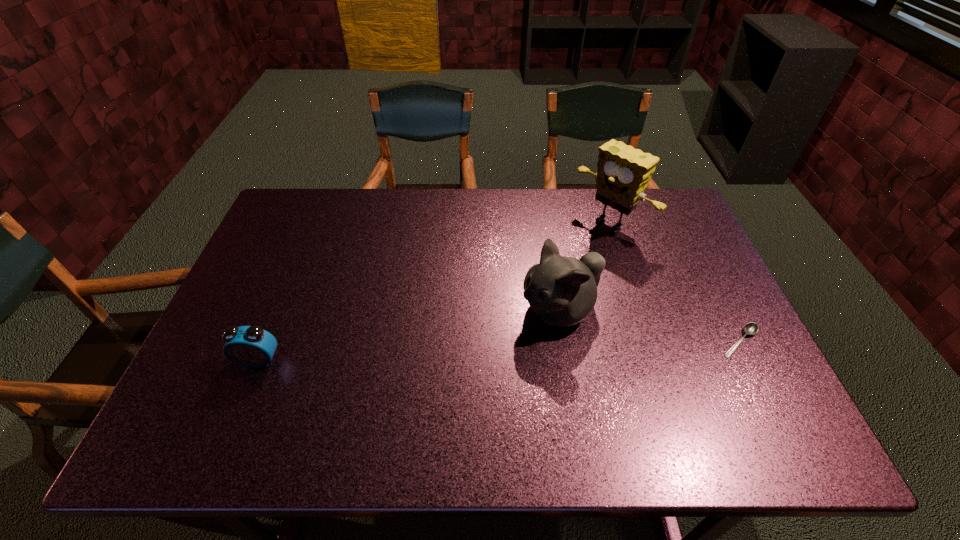
Locate an element on the screen. vacant space on the desktop that is between the alarm clock and the shortest object and is positioned on the face of the hamster is located at coordinates (488, 351).

At what (x,y) coordinates should I click in order to perform the action: click on vacant space on the desktop that is between the alarm clock and the shortest object and is positioned on the front-facing side of the sponge. Please return your answer as a coordinate pair (x, y). The height and width of the screenshot is (540, 960). Looking at the image, I should click on (445, 353).